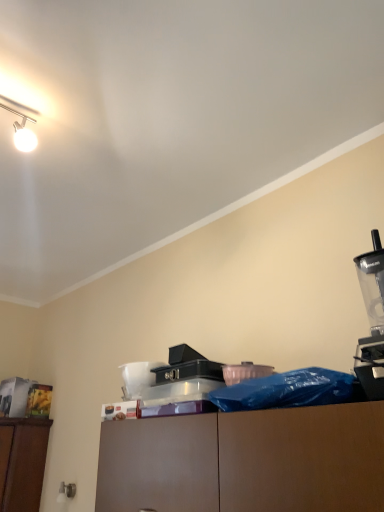
Locate an element on the screen. transparent plastic blender at right is located at coordinates (372, 321).

This screenshot has width=384, height=512. Describe the element at coordinates (372, 321) in the screenshot. I see `transparent plastic blender at right` at that location.

The height and width of the screenshot is (512, 384). What do you see at coordinates (187, 366) in the screenshot?
I see `black plastic case at center` at bounding box center [187, 366].

Where is `black plastic case at center`? This screenshot has width=384, height=512. black plastic case at center is located at coordinates (187, 366).

Where is `transparent plastic blender at right`? The width and height of the screenshot is (384, 512). transparent plastic blender at right is located at coordinates (372, 321).

In the image, is black plastic case at center on the left side or the right side of transparent plastic blender at right?

From the image, it's evident that black plastic case at center is to the left of transparent plastic blender at right.

Which is behind, black plastic case at center or transparent plastic blender at right?

black plastic case at center is further away from the camera.

Does point (181, 345) come in front of point (367, 269)?

No, (181, 345) is further to viewer.

From the image's perspective, relative to transparent plastic blender at right, is black plastic case at center above or below?

Based on their image positions, black plastic case at center is located beneath transparent plastic blender at right.

From a real-world perspective, relative to transparent plastic blender at right, is black plastic case at center vertically above or below?

In terms of real-world spatial position, black plastic case at center is below transparent plastic blender at right.

Can you confirm if black plastic case at center is wider than transparent plastic blender at right?

In fact, black plastic case at center might be narrower than transparent plastic blender at right.

Considering the relative sizes of black plastic case at center and transparent plastic blender at right in the image provided, is black plastic case at center shorter than transparent plastic blender at right?

Yes, black plastic case at center is shorter than transparent plastic blender at right.

Which of these two, black plastic case at center or transparent plastic blender at right, is bigger?

transparent plastic blender at right.

Is transparent plastic blender at right inside black plastic case at center?

That's incorrect, transparent plastic blender at right is not inside black plastic case at center.

Is there a large distance between black plastic case at center and transparent plastic blender at right?

No, there isn't a large distance between black plastic case at center and transparent plastic blender at right.

Is black plastic case at center turned away from transparent plastic blender at right?

No, black plastic case at center is not facing the opposite direction of transparent plastic blender at right.

How distant is black plastic case at center from transparent plastic blender at right?

black plastic case at center and transparent plastic blender at right are 26.76 inches apart from each other.

Image resolution: width=384 pixels, height=512 pixels. I want to click on job lying below the transparent plastic blender at right (from the image's perspective), so (187, 366).

Is transparent plastic blender at right to the right of black plastic case at center from the viewer's perspective?

Yes.

Is the position of transparent plastic blender at right more distant than that of black plastic case at center?

No, it is not.

Which is behind, point (361, 272) or point (192, 366)?

The point (192, 366) is farther from the camera.

From the image's perspective, is transparent plastic blender at right on black plastic case at center?

Yes, from the image's perspective, transparent plastic blender at right is above black plastic case at center.

From a real-world perspective, who is located higher, transparent plastic blender at right or black plastic case at center?

transparent plastic blender at right.

Considering the relative sizes of transparent plastic blender at right and black plastic case at center in the image provided, is transparent plastic blender at right thinner than black plastic case at center?

Incorrect, the width of transparent plastic blender at right is not less than that of black plastic case at center.

Can you confirm if transparent plastic blender at right is shorter than black plastic case at center?

In fact, transparent plastic blender at right may be taller than black plastic case at center.

Between transparent plastic blender at right and black plastic case at center, which one has larger size?

transparent plastic blender at right.

Is transparent plastic blender at right located outside black plastic case at center?

Yes, transparent plastic blender at right is outside of black plastic case at center.

Is transparent plastic blender at right beside black plastic case at center?

No.

Is transparent plastic blender at right facing away from black plastic case at center?

No.

Can you tell me how much transparent plastic blender at right and black plastic case at center differ in facing direction?

Answer: The angular difference between transparent plastic blender at right and black plastic case at center is 5.48 degrees.

The height and width of the screenshot is (512, 384). What are the coordinates of `job located on the left of transparent plastic blender at right` in the screenshot? It's located at (187, 366).

This screenshot has height=512, width=384. I want to click on job on the left of transparent plastic blender at right, so click(187, 366).

Locate an element on the screen. This screenshot has width=384, height=512. job below the transparent plastic blender at right (from the image's perspective) is located at coordinates (187, 366).